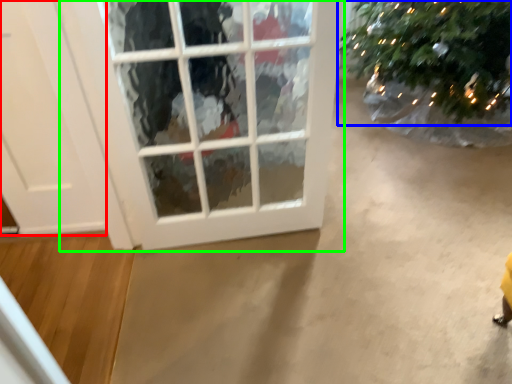
Question: Considering the real-world distances, which object is farthest from door (highlighted by a red box)? christmas tree (highlighted by a blue box) or window (highlighted by a green box)?

Choices:
 (A) christmas tree
 (B) window

Answer: (A)